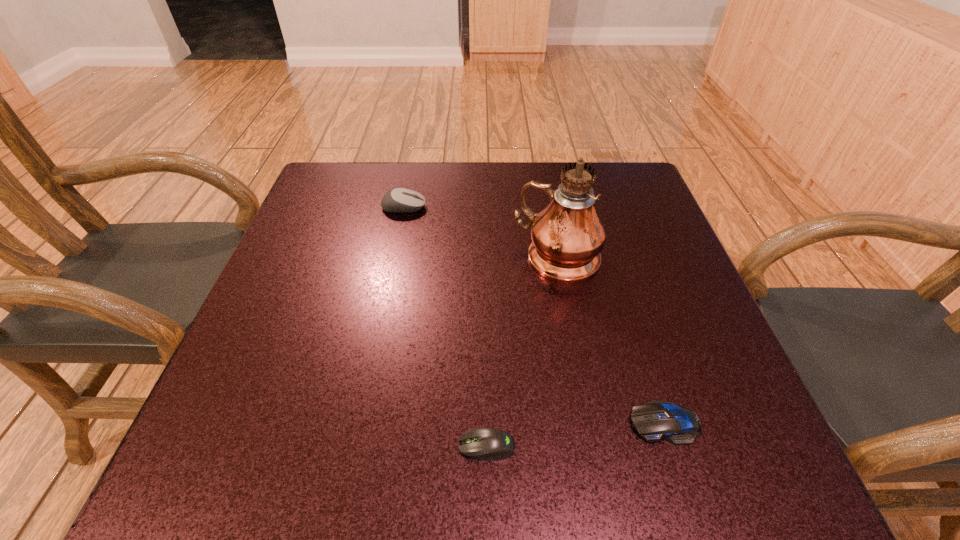
Where is `vacant point located on the button side of the rightmost computer mouse`? vacant point located on the button side of the rightmost computer mouse is located at coordinates (499, 423).

At what (x,y) coordinates should I click in order to perform the action: click on vacant space located on the wheel side of the second object from left to right. Please return your answer as a coordinate pair (x, y). Looking at the image, I should click on (235, 446).

The width and height of the screenshot is (960, 540). In order to click on vacant space located on the wheel side of the second object from left to right in this screenshot , I will do `click(411, 446)`.

Locate an element on the screen. The height and width of the screenshot is (540, 960). free space located 0.290m on the wheel side of the second object from left to right is located at coordinates pyautogui.click(x=262, y=446).

You are a GUI agent. You are given a task and a screenshot of the screen. Output one action in this format:
    pyautogui.click(x=<x>, y=<y>)
    Task: Click on the object that is at the far edge
    The image size is (960, 540).
    Given the screenshot: What is the action you would take?
    pyautogui.click(x=399, y=200)

This screenshot has height=540, width=960. I want to click on object at the right edge, so click(658, 419).

At what (x,y) coordinates should I click in order to perform the action: click on object that is at the near right corner. Please return your answer as a coordinate pair (x, y). Looking at the image, I should click on (658, 419).

Where is `vacant space at the far edge`? The image size is (960, 540). vacant space at the far edge is located at coordinates (515, 175).

Locate an element on the screen. free point at the near edge is located at coordinates (382, 438).

Locate an element on the screen. The width and height of the screenshot is (960, 540). vacant space at the left edge is located at coordinates (244, 395).